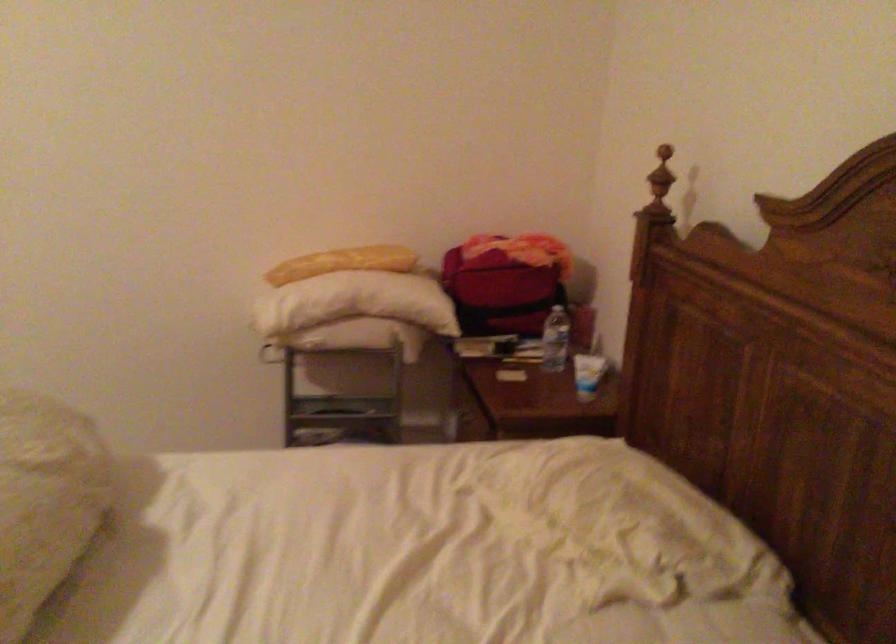
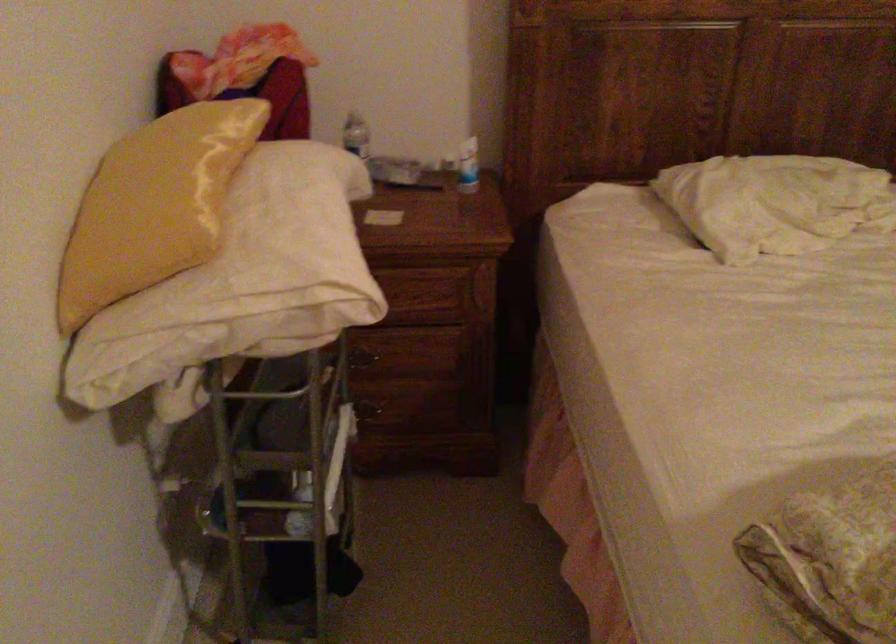
Find the pixel in the second image that matches [579,373] in the first image.

(468, 166)